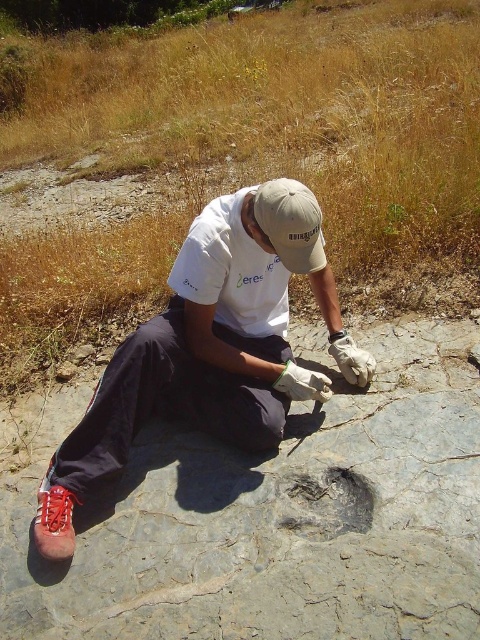
Between dark gray stone fossil at center and red leather shoe at lower left, which one has more height?

Standing taller between the two is red leather shoe at lower left.

Which is more to the right, dark gray stone fossil at center or red leather shoe at lower left?

dark gray stone fossil at center

Measure the distance between dark gray stone fossil at center and camera.

The distance of dark gray stone fossil at center from camera is 5.94 feet.

Locate an element on the screen. The width and height of the screenshot is (480, 640). dark gray stone fossil at center is located at coordinates (324, 502).

Between gray stone fossil at center and white cotton shirt at center, which one has more height?

Standing taller between the two is white cotton shirt at center.

Is gray stone fossil at center bigger than white cotton shirt at center?

Correct, gray stone fossil at center is larger in size than white cotton shirt at center.

Identify the location of gray stone fossil at center. (268, 513).

This screenshot has width=480, height=640. Find the location of `gray stone fossil at center`. gray stone fossil at center is located at coordinates (268, 513).

Can you confirm if white cotton shirt at center is positioned below dark gray stone fossil at center?

Actually, white cotton shirt at center is above dark gray stone fossil at center.

Is white cotton shirt at center to the right of dark gray stone fossil at center from the viewer's perspective?

Incorrect, white cotton shirt at center is not on the right side of dark gray stone fossil at center.

At what (x,y) coordinates should I click in order to perform the action: click on white cotton shirt at center. Please return your answer as a coordinate pair (x, y). Looking at the image, I should click on (218, 337).

Locate an element on the screen. white cotton shirt at center is located at coordinates (218, 337).